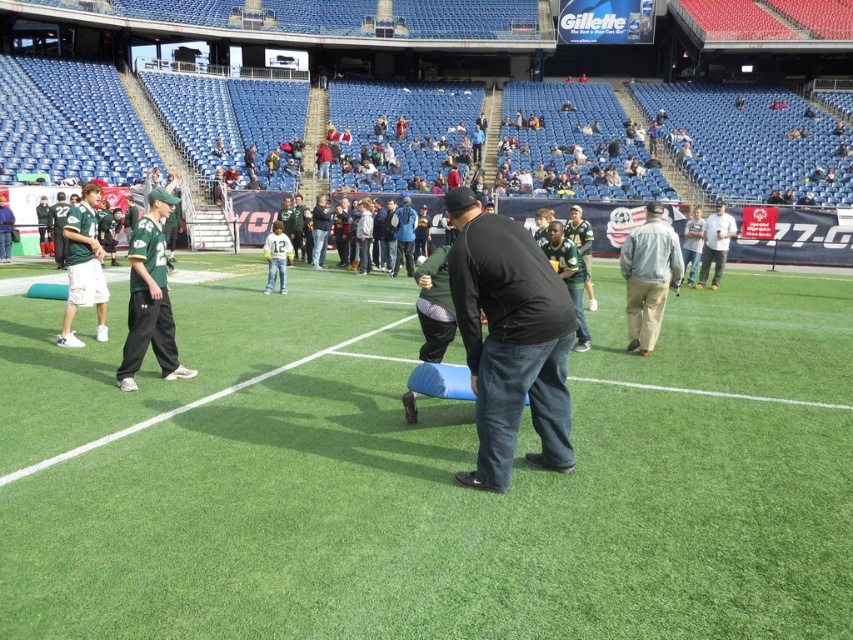
Is green artificial turf at center to the right of light gray jacket at center from the viewer's perspective?

No, green artificial turf at center is not to the right of light gray jacket at center.

Between green artificial turf at center and light gray jacket at center, which one appears on the left side from the viewer's perspective?

Positioned to the left is green artificial turf at center.

Image resolution: width=853 pixels, height=640 pixels. In order to click on green artificial turf at center in this screenshot , I will do `click(430, 477)`.

What are the coordinates of `green artificial turf at center` in the screenshot? It's located at (430, 477).

Is point (463, 196) more distant than point (635, 337)?

No, (463, 196) is in front of (635, 337).

Is point (471, 323) closer to viewer compared to point (640, 314)?

Yes, it is.

Measure the distance between point (x=491, y=371) and camera.

The distance of point (x=491, y=371) from camera is 4.76 meters.

Identify the location of black matte shirt at center. 509,339.

Does green artificial turf at center appear under matte green jersey at left?

Correct, green artificial turf at center is located below matte green jersey at left.

Who is lower down, green artificial turf at center or matte green jersey at left?

green artificial turf at center is lower down.

Identify the location of green artificial turf at center. (430, 477).